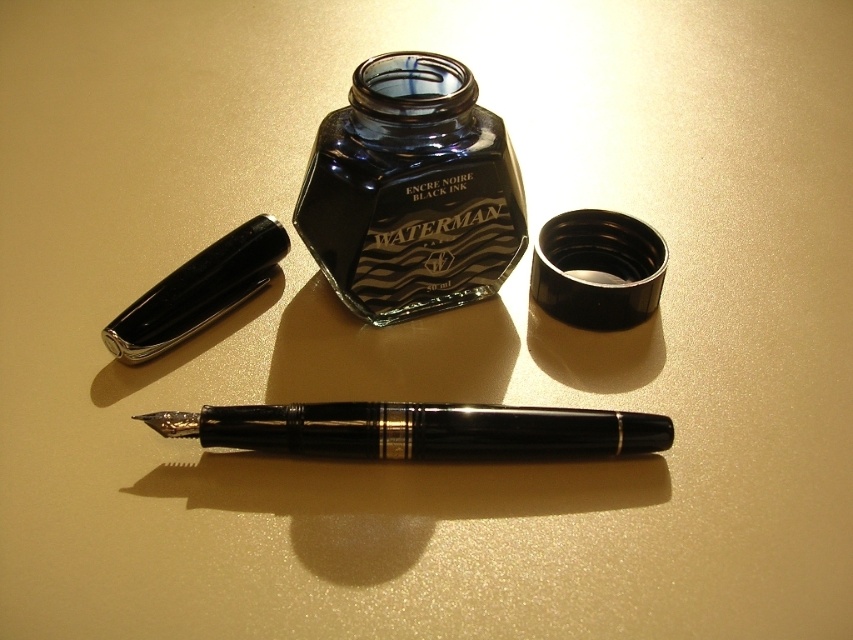
You are organizing a desk and need to place a new pen. The desk has a designated spot marked at point (419,429). What object is currently occupying that location?

The point at (419,429) is occupied by the black polished pen at center.

Looking at this image, you are organizing a desk and need to place a 12 inch ruler between the black glass bottle at center and the black polished pen at center. Is there enough space to fit the ruler horizontally between them?

The distance between the black glass bottle at center and the black polished pen at center is 10.86 inches, which is less than the 12 inch ruler, so the ruler cannot fit horizontally between them.